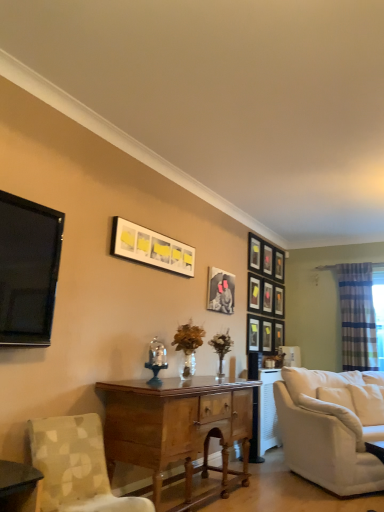
Describe the element at coordinates (254, 293) in the screenshot. Image resolution: width=384 pixels, height=512 pixels. I see `matte black picture frame at upper center, the eighth picture frame positioned from the right` at that location.

Locate an element on the screen. The image size is (384, 512). white soft cushion at lower right is located at coordinates (335, 415).

Describe the element at coordinates (335, 415) in the screenshot. The image size is (384, 512). I see `white soft cushion at lower right` at that location.

The width and height of the screenshot is (384, 512). Describe the element at coordinates (279, 265) in the screenshot. I see `matte black picture frame at upper center, which appears as the 11th picture frame when viewed from the left` at that location.

This screenshot has height=512, width=384. In order to click on matte black picture frame at upper center, which is the 1th picture frame from right to left in this screenshot , I will do `click(279, 265)`.

Where is `matte black picture frame at upper center, the 8th picture frame viewed from the left`? The width and height of the screenshot is (384, 512). matte black picture frame at upper center, the 8th picture frame viewed from the left is located at coordinates (267, 259).

This screenshot has height=512, width=384. I want to click on matte black picture frame at center-right, arranged as the sixth picture frame when viewed from the right, so click(x=266, y=336).

Is matte black picture frame at center-right, which appears as the 6th picture frame when viewed from the left, to the left of matte black picture frame at upper center, which appears as the first picture frame when viewed from the left, from the viewer's perspective?

In fact, matte black picture frame at center-right, which appears as the 6th picture frame when viewed from the left, is to the right of matte black picture frame at upper center, which appears as the first picture frame when viewed from the left.

From the image's perspective, is matte black picture frame at center-right, which appears as the 6th picture frame when viewed from the left, above or below matte black picture frame at upper center, which ranks as the 11th picture frame in right-to-left order?

From the image's perspective, matte black picture frame at center-right, which appears as the 6th picture frame when viewed from the left, appears below matte black picture frame at upper center, which ranks as the 11th picture frame in right-to-left order.

Is point (264, 343) closer to viewer compared to point (120, 222)?

No, (264, 343) is behind (120, 222).

From a real-world perspective, is matte black picture frame at center-right, arranged as the sixth picture frame when viewed from the right, physically located above or below matte black picture frame at upper center, which appears as the first picture frame when viewed from the left?

matte black picture frame at center-right, arranged as the sixth picture frame when viewed from the right, is below matte black picture frame at upper center, which appears as the first picture frame when viewed from the left.

Can you confirm if matte black picture frame at upper right, which appears as the fifth picture frame when viewed from the left, is positioned to the right of matte black picture frame at upper right, which is counted as the tenth picture frame, starting from the left?

Incorrect, matte black picture frame at upper right, which appears as the fifth picture frame when viewed from the left, is not on the right side of matte black picture frame at upper right, which is counted as the tenth picture frame, starting from the left.

Is matte black picture frame at upper right, which is counted as the tenth picture frame, starting from the left, located within matte black picture frame at upper right, which is counted as the 7th picture frame, starting from the right?

No, matte black picture frame at upper right, which is counted as the 7th picture frame, starting from the right, does not contain matte black picture frame at upper right, which is counted as the tenth picture frame, starting from the left.

Does matte black picture frame at upper right, which is counted as the 7th picture frame, starting from the right, have a smaller size compared to matte black picture frame at upper right, positioned as the 2th picture frame in right-to-left order?

Incorrect, matte black picture frame at upper right, which is counted as the 7th picture frame, starting from the right, is not smaller in size than matte black picture frame at upper right, positioned as the 2th picture frame in right-to-left order.

Is matte black picture frame at upper center, the eighth picture frame positioned from the right, looking in the opposite direction of matte black picture frame at upper center, which is the 1th picture frame from right to left?

No, matte black picture frame at upper center, the eighth picture frame positioned from the right, is not facing away from matte black picture frame at upper center, which is the 1th picture frame from right to left.

Between matte black picture frame at upper center, the 4th picture frame positioned from the left, and matte black picture frame at upper center, which is the 1th picture frame from right to left, which one has less height?

Standing shorter between the two is matte black picture frame at upper center, which is the 1th picture frame from right to left.

Considering the points (248, 301) and (278, 271), which point is behind, point (248, 301) or point (278, 271)?

The point (278, 271) is farther.

Would you say matte black picture frame at upper center, the eighth picture frame positioned from the right, is to the left or to the right of matte black picture frame at upper center, which appears as the 11th picture frame when viewed from the left, in the picture?

matte black picture frame at upper center, the eighth picture frame positioned from the right, is to the left of matte black picture frame at upper center, which appears as the 11th picture frame when viewed from the left.

From the image's perspective, is patterned fabric chair at lower left located beneath matte black picture frame at upper center, marked as the 9th picture frame in a left-to-right arrangement?

Yes, from the image's perspective, patterned fabric chair at lower left is beneath matte black picture frame at upper center, marked as the 9th picture frame in a left-to-right arrangement.

Is point (71, 421) in front of point (279, 340)?

Yes, it is in front of point (279, 340).

From the image's perspective, which picture frame is the 1st one above the patterned fabric chair at lower left? Please provide its 2D coordinates.

[(278, 335)]

Can you confirm if patterned fabric chair at lower left is positioned to the right of matte black picture frame at center-right, arranged as the sixth picture frame when viewed from the right?

In fact, patterned fabric chair at lower left is to the left of matte black picture frame at center-right, arranged as the sixth picture frame when viewed from the right.

From their relative heights in the image, would you say patterned fabric chair at lower left is taller or shorter than matte black picture frame at center-right, which appears as the 6th picture frame when viewed from the left?

In the image, patterned fabric chair at lower left appears to be taller than matte black picture frame at center-right, which appears as the 6th picture frame when viewed from the left.

Is patterned fabric chair at lower left bigger or smaller than matte black picture frame at center-right, which appears as the 6th picture frame when viewed from the left?

Considering their sizes, patterned fabric chair at lower left takes up more space than matte black picture frame at center-right, which appears as the 6th picture frame when viewed from the left.

From the image's perspective, between wooden desk at center and matte black picture frame at upper right, which is counted as the fifth picture frame, starting from the right, which one is located above?

matte black picture frame at upper right, which is counted as the fifth picture frame, starting from the right, from the image's perspective.

Does wooden desk at center lie behind matte black picture frame at upper right, which is counted as the fifth picture frame, starting from the right?

No.

At what (x,y) coordinates should I click in order to perform the action: click on desk below the matte black picture frame at upper right, the 7th picture frame from the left (from the image's perspective). Please return your answer as a coordinate pair (x, y). Looking at the image, I should click on (177, 428).

Can you tell me how much wooden desk at center and matte black picture frame at upper center, marked as the 9th picture frame in a left-to-right arrangement, differ in facing direction?

0.285 degrees separate the facing orientations of wooden desk at center and matte black picture frame at upper center, marked as the 9th picture frame in a left-to-right arrangement.

Which is more to the left, wooden desk at center or matte black picture frame at upper center, placed as the third picture frame when sorted from right to left?

wooden desk at center is more to the left.

In the scene shown: Is wooden desk at center outside of matte black picture frame at upper center, placed as the third picture frame when sorted from right to left?

wooden desk at center is positioned outside matte black picture frame at upper center, placed as the third picture frame when sorted from right to left.

Is wooden desk at center facing away from matte black picture frame at upper center, marked as the 9th picture frame in a left-to-right arrangement?

wooden desk at center does not have its back to matte black picture frame at upper center, marked as the 9th picture frame in a left-to-right arrangement.

At what (x,y) coordinates should I click in order to perform the action: click on picture frame that is the 7th one below the matte black picture frame at upper center, which appears as the first picture frame when viewed from the left (from a real-world perspective). Please return your answer as a coordinate pair (x, y). The image size is (384, 512). Looking at the image, I should click on (266, 336).

There is a matte black picture frame at upper right, which is counted as the tenth picture frame, starting from the left. Identify the location of the 5th picture frame above it (from a real-world perspective). Image resolution: width=384 pixels, height=512 pixels. (254, 252).

When comparing their distances from white soft cushion at lower right, does matte black picture frame at center, placed as the 10th picture frame when sorted from right to left, or matte black picture frame at upper center, which appears as the 11th picture frame when viewed from the left, seem further?

matte black picture frame at upper center, which appears as the 11th picture frame when viewed from the left, is positioned further to the anchor white soft cushion at lower right.

Looking at the image, which one is located further to black glossy tv at left, matte black picture frame at upper center, which appears as the first picture frame when viewed from the left, or white soft cushion at lower right?

Among the two, white soft cushion at lower right is located further to black glossy tv at left.

When comparing their distances from white soft cushion at lower right, does white fabric couch at right or matte black picture frame at upper center, which appears as the 11th picture frame when viewed from the left, seem closer?

The object closer to white soft cushion at lower right is white fabric couch at right.

Looking at the image, which one is located further to matte black picture frame at center, the 2th picture frame positioned from the left, matte black picture frame at upper right, which is counted as the tenth picture frame, starting from the left, or matte black picture frame at upper center, the eighth picture frame positioned from the right?

The object further to matte black picture frame at center, the 2th picture frame positioned from the left, is matte black picture frame at upper right, which is counted as the tenth picture frame, starting from the left.

Based on their spatial positions, is striped fabric curtain at right or matte black picture frame at center, acting as the 9th picture frame starting from the right, further from patterned fabric chair at lower left?

The object further to patterned fabric chair at lower left is striped fabric curtain at right.

In the scene shown: Estimate the real-world distances between objects in this image. Which object is further from patterned fabric chair at lower left, matte black picture frame at upper center, which is the 1th picture frame from right to left, or black glossy tv at left?

matte black picture frame at upper center, which is the 1th picture frame from right to left, is positioned further to the anchor patterned fabric chair at lower left.

Looking at the image, which one is located closer to striped fabric curtain at right, matte black picture frame at center, the 2th picture frame positioned from the left, or matte black picture frame at upper right, which appears as the fifth picture frame when viewed from the left?

The object closer to striped fabric curtain at right is matte black picture frame at upper right, which appears as the fifth picture frame when viewed from the left.

Considering their positions, is matte black picture frame at upper right, which is counted as the 7th picture frame, starting from the right, positioned further to black glossy tv at left than matte black picture frame at upper right, which is counted as the fifth picture frame, starting from the right?

The object further to black glossy tv at left is matte black picture frame at upper right, which is counted as the fifth picture frame, starting from the right.

Where is `desk between patterned fabric chair at lower left and matte black picture frame at upper right, positioned as the 2th picture frame in right-to-left order, in the front-back direction`? desk between patterned fabric chair at lower left and matte black picture frame at upper right, positioned as the 2th picture frame in right-to-left order, in the front-back direction is located at coordinates (177, 428).

The height and width of the screenshot is (512, 384). In order to click on studio couch between wooden desk at center and matte black picture frame at center, the 2th picture frame positioned from the left, in the front-back direction in this screenshot , I will do `click(332, 426)`.

The height and width of the screenshot is (512, 384). I want to click on pillow located between black glossy tv at left and matte black picture frame at upper center, which appears as the 11th picture frame when viewed from the left, in the depth direction, so click(335, 415).

At what (x,y) coordinates should I click in order to perform the action: click on desk between patterned fabric chair at lower left and white soft cushion at lower right from left to right. Please return your answer as a coordinate pair (x, y). The width and height of the screenshot is (384, 512). Looking at the image, I should click on (177, 428).